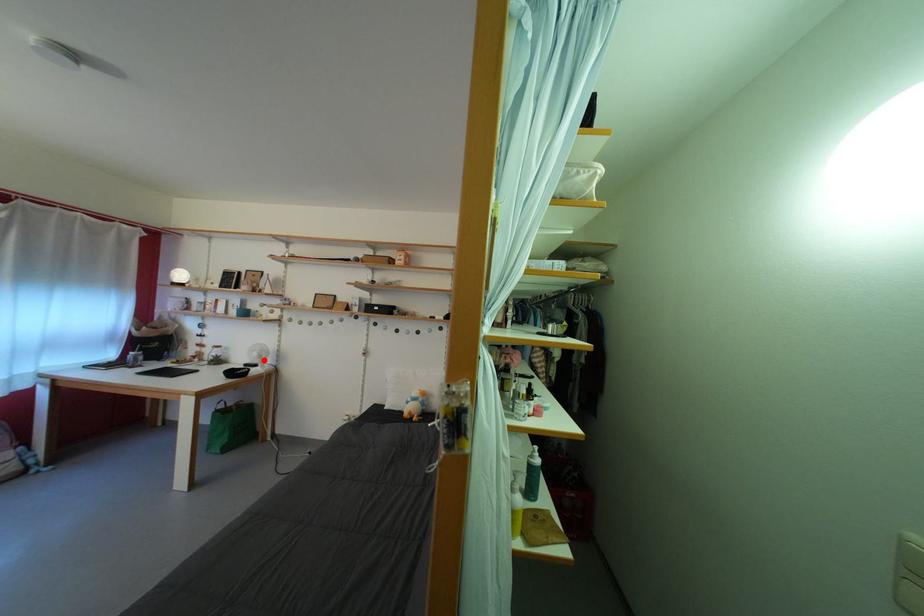
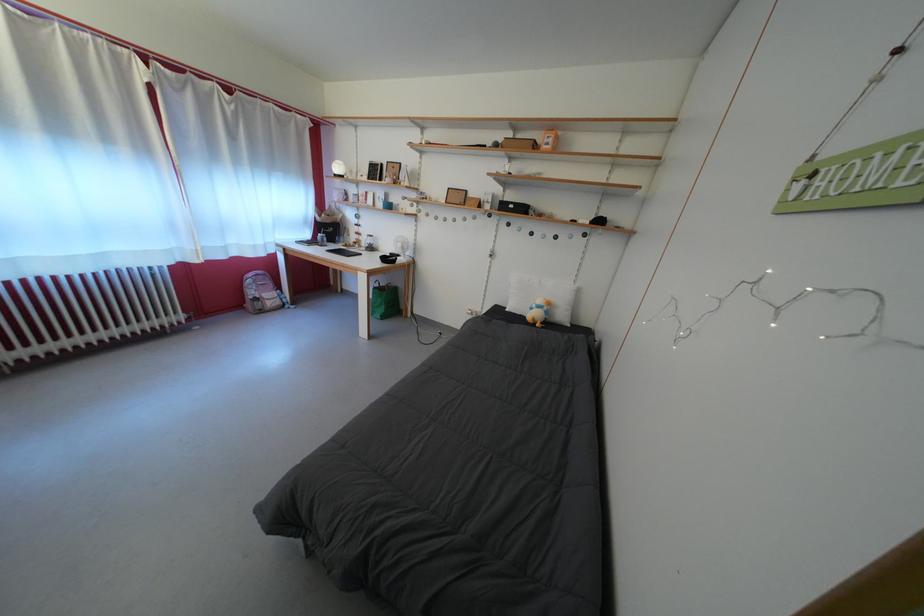
Question: I am providing you with two images of the same scene from different viewpoints. Image1 has a red point marked. In image2, the corresponding 3D location appears at what relative position? Reply with the corresponding letter.

Choices:
 (A) Closer
 (B) Farther

Answer: (A)